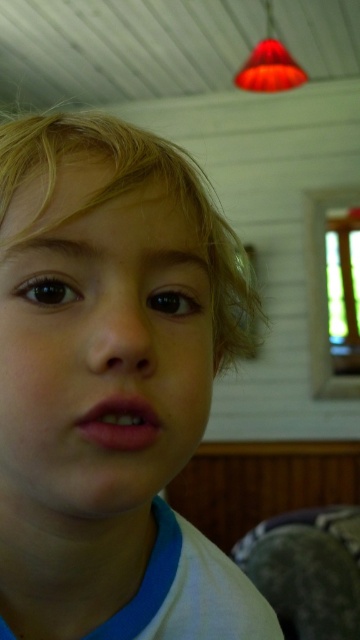
Does smooth skin face at center appear over blonde silky hair at center?

No, smooth skin face at center is not above blonde silky hair at center.

Between smooth skin face at center and blonde silky hair at center, which one is positioned lower?

smooth skin face at center is lower down.

Is point (195, 285) farther from camera compared to point (173, 164)?

No.

This screenshot has height=640, width=360. I want to click on smooth skin face at center, so click(x=101, y=352).